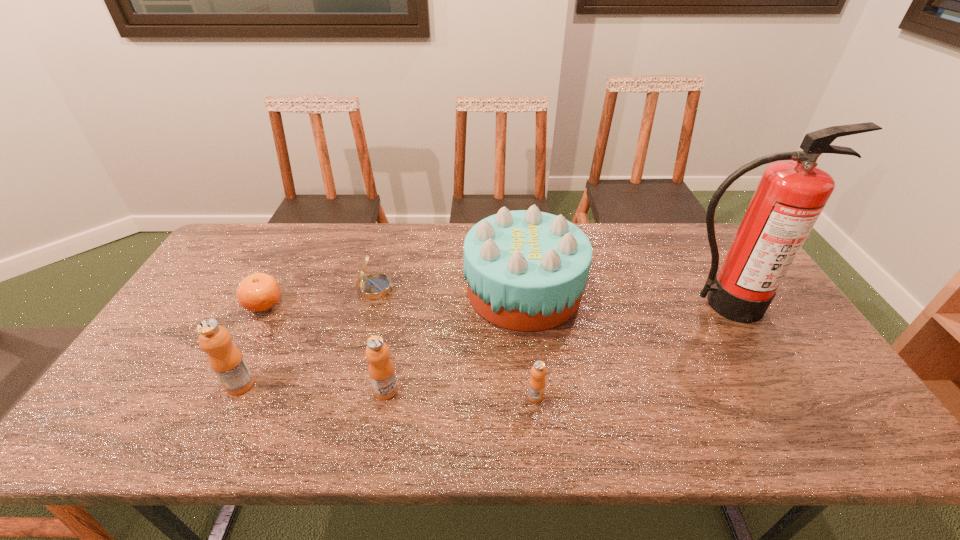
Point out which object is positioned as the nearest to the compass. Please provide its 2D coordinates. Your answer should be formatted as a tuple, i.e. [(x, y)], where the tuple contains the x and y coordinates of a point satisfying the conditions above.

[(526, 270)]

In order to click on orange juice identified as the closest to the rightmost object in this screenshot , I will do `click(537, 381)`.

Identify the location of orange juice that is the second nearest to the leftmost orange juice. 537,381.

Where is `free space that satisfies the following two spatial constraints: 1. on the back side of the shortest object; 2. on the right side of the cake`? This screenshot has width=960, height=540. free space that satisfies the following two spatial constraints: 1. on the back side of the shortest object; 2. on the right side of the cake is located at coordinates point(272,290).

Locate an element on the screen. The height and width of the screenshot is (540, 960). vacant space that satisfies the following two spatial constraints: 1. on the front-facing side of the tallest object; 2. on the front label of the leftmost orange juice is located at coordinates (769, 384).

The image size is (960, 540). Identify the location of free space that satisfies the following two spatial constraints: 1. on the front side of the cake; 2. on the front label of the second shortest orange juice. (535, 390).